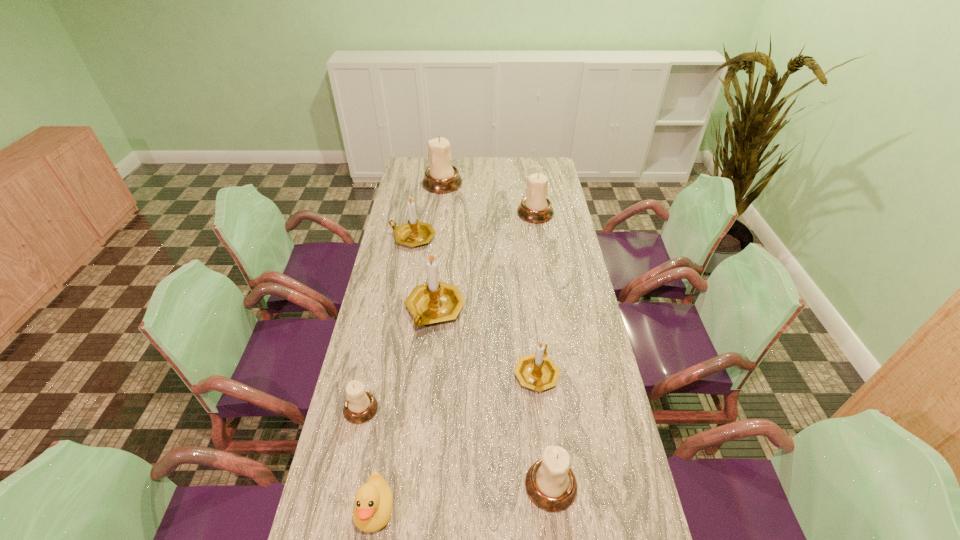
You are a GUI agent. You are given a task and a screenshot of the screen. Output one action in this format:
    pyautogui.click(x=<x>, y=<y>)
    Task: Click on the gold candle holder that is the second nearest to the nearest candle holder
    This screenshot has height=540, width=960.
    Given the screenshot: What is the action you would take?
    pyautogui.click(x=436, y=301)

Where is `gold candle holder identified as the closest to the fourth nearest candle holder`? gold candle holder identified as the closest to the fourth nearest candle holder is located at coordinates (537, 371).